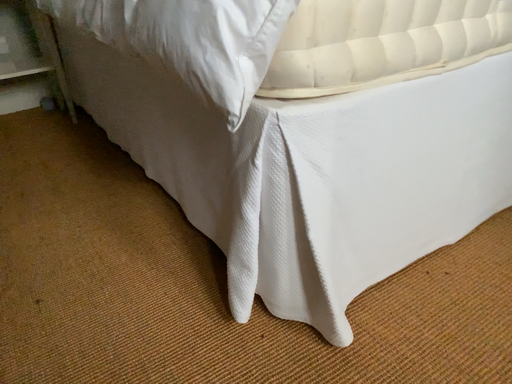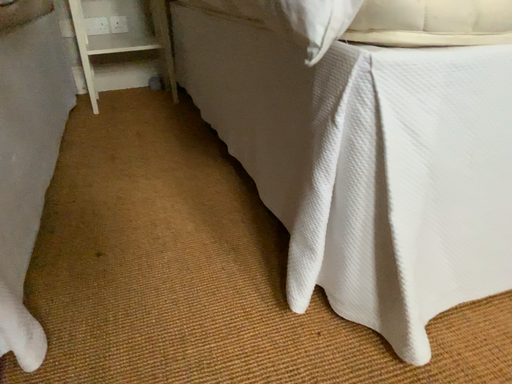
Question: How did the camera likely rotate when shooting the video?

Choices:
 (A) rotated right
 (B) rotated left

Answer: (B)